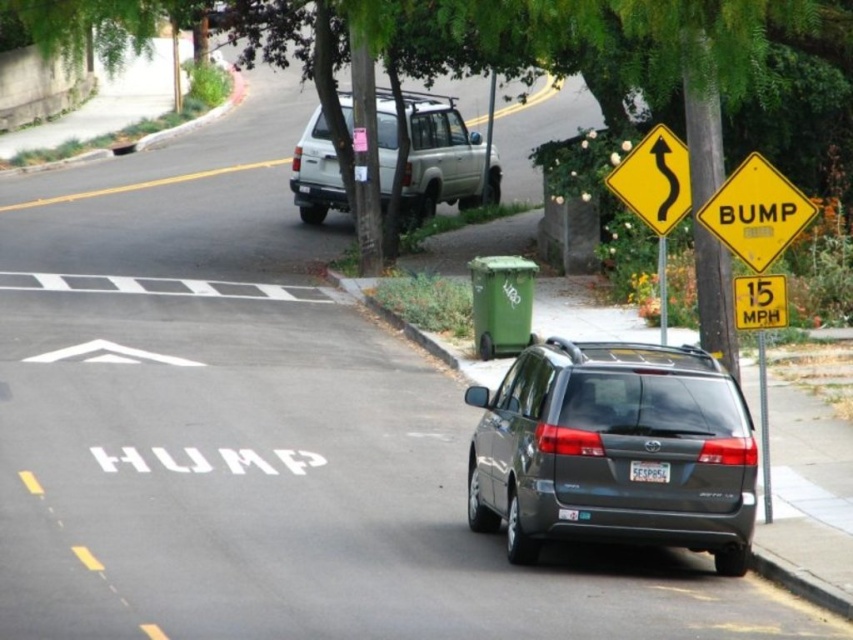
Based on the photo, is yellow diamond-shaped sign at right further to camera compared to white plastic license plate at center?

Yes, yellow diamond-shaped sign at right is further from the viewer.

Who is more forward, (778, 188) or (635, 476)?

Positioned in front is point (635, 476).

Is point (813, 211) positioned after point (662, 480)?

That is True.

In order to click on yellow diamond-shaped sign at right in this screenshot , I will do `click(756, 212)`.

Which is more to the left, silver metallic suv at upper center or yellow diamond-shaped sign at right?

silver metallic suv at upper center

Between point (312, 157) and point (785, 228), which one is positioned behind?

The point (312, 157) is more distant.

What are the coordinates of `silver metallic suv at upper center` in the screenshot? It's located at (439, 157).

Describe the element at coordinates (613, 451) in the screenshot. I see `matte gray minivan at lower right` at that location.

Can you confirm if matte gray minivan at lower right is positioned above white plastic license plate at center?

No.

Which is behind, point (561, 440) or point (648, 481)?

The point (648, 481) is behind.

Locate an element on the screen. matte gray minivan at lower right is located at coordinates (613, 451).